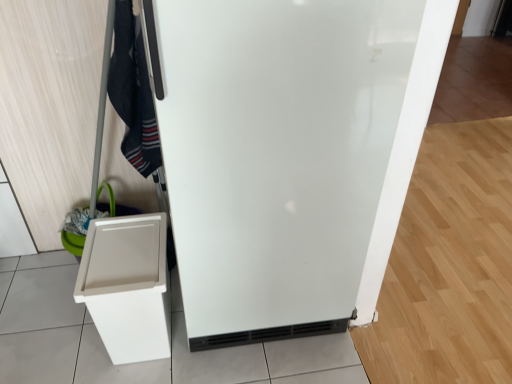
Question: From the image's perspective, is white glossy refrigerator at center on top of white plastic bin at lower left?

Choices:
 (A) no
 (B) yes

Answer: (B)

Question: Considering the relative sizes of white glossy refrigerator at center and white plastic bin at lower left in the image provided, is white glossy refrigerator at center wider than white plastic bin at lower left?

Choices:
 (A) yes
 (B) no

Answer: (A)

Question: Considering the relative sizes of white glossy refrigerator at center and white plastic bin at lower left in the image provided, is white glossy refrigerator at center thinner than white plastic bin at lower left?

Choices:
 (A) no
 (B) yes

Answer: (A)

Question: Does white glossy refrigerator at center have a greater height compared to white plastic bin at lower left?

Choices:
 (A) yes
 (B) no

Answer: (A)

Question: Could you tell me if white glossy refrigerator at center is facing white plastic bin at lower left?

Choices:
 (A) no
 (B) yes

Answer: (A)

Question: From a real-world perspective, is white plastic bin at lower left physically located above or below black cotton scarf at upper left?

Choices:
 (A) below
 (B) above

Answer: (A)

Question: Is point (81, 299) closer or farther from the camera than point (156, 127)?

Choices:
 (A) closer
 (B) farther

Answer: (A)

Question: Is white plastic bin at lower left bigger or smaller than black cotton scarf at upper left?

Choices:
 (A) big
 (B) small

Answer: (A)

Question: Considering the positions of white plastic bin at lower left and black cotton scarf at upper left in the image, is white plastic bin at lower left wider or thinner than black cotton scarf at upper left?

Choices:
 (A) thin
 (B) wide

Answer: (B)

Question: From the image's perspective, is black cotton scarf at upper left located above or below white plastic bin at lower left?

Choices:
 (A) below
 (B) above

Answer: (B)

Question: Is black cotton scarf at upper left spatially inside white plastic bin at lower left, or outside of it?

Choices:
 (A) outside
 (B) inside

Answer: (A)

Question: From a real-world perspective, is black cotton scarf at upper left physically located above or below white plastic bin at lower left?

Choices:
 (A) above
 (B) below

Answer: (A)

Question: Relative to white plastic bin at lower left, is black cotton scarf at upper left in front or behind?

Choices:
 (A) front
 (B) behind

Answer: (A)

Question: Is point (166, 314) closer or farther from the camera than point (321, 276)?

Choices:
 (A) farther
 (B) closer

Answer: (A)

Question: From their relative heights in the image, would you say white plastic bin at lower left is taller or shorter than white glossy refrigerator at center?

Choices:
 (A) tall
 (B) short

Answer: (B)